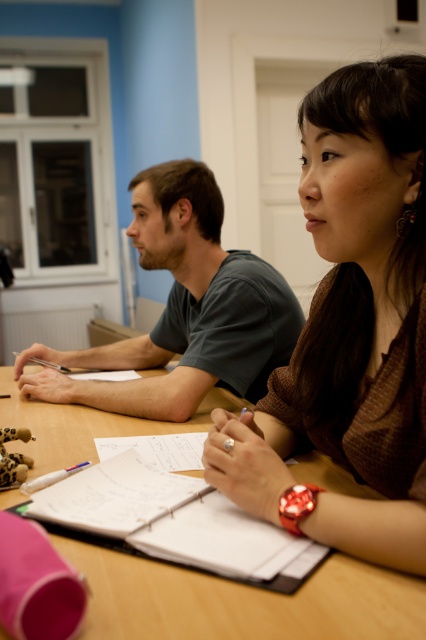
You are a photographer trying to capture a closeup of the wooden table at center and the matte gray shirt at center. Given that the camera you are using has a limited focus range, which object should you prioritize to ensure it is in focus, considering their sizes?

The wooden table at center has a smaller size compared to matte gray shirt at center. Therefore, to ensure proper focus, prioritize the matte gray shirt at center as it occupies more space in the frame.

You are standing in a classroom and need to place a 10cm wide book on the table. The book must be placed exactly at the coordinates where the matte gray shirt at center is located. Is there enough space on the table to place the book there?

The position of matte gray shirt at center is at point (x=184, y=308). Since the coordinates are within the table area, there is enough space to place the book there.